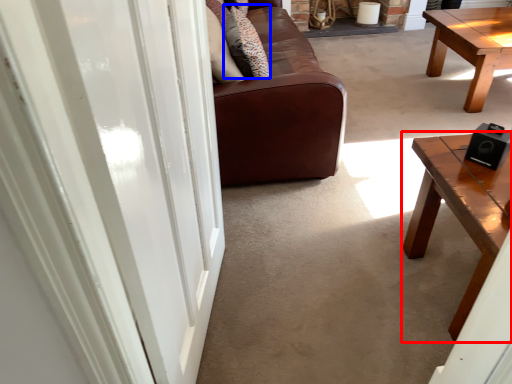
Question: Which object is closer to the camera taking this photo, coffee table (highlighted by a red box) or pillow (highlighted by a blue box)?

Choices:
 (A) coffee table
 (B) pillow

Answer: (A)